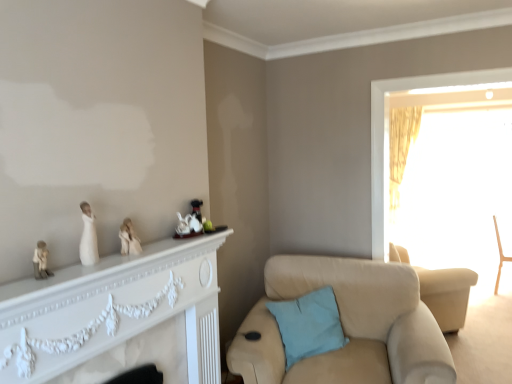
At what (x,y) coordinates should I click in order to perform the action: click on free space to the back side of white porcelain figurine at left, which is the 2th person from right to left. Please return your answer as a coordinate pair (x, y). This screenshot has width=512, height=384. Looking at the image, I should click on (117, 257).